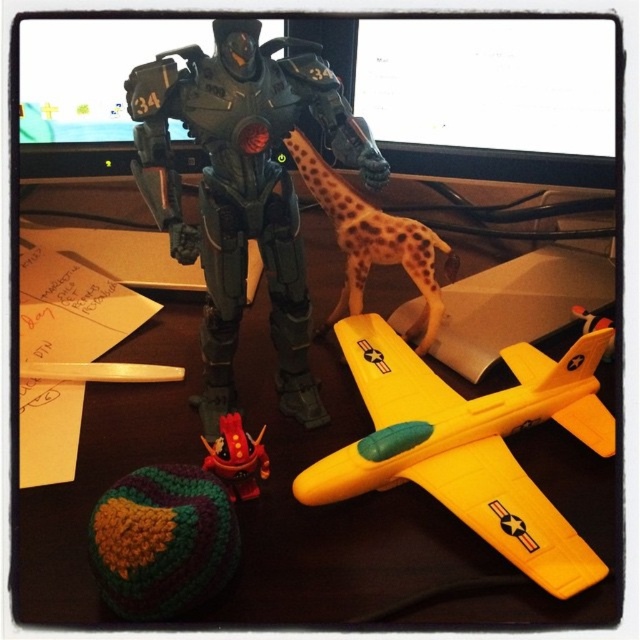
Question: Which object appears closest to the camera in this image?

Choices:
 (A) yellow matte airplane at center
 (B) rubberized red robot at lower center

Answer: (A)

Question: Can you confirm if yellow matte airplane at center is bigger than spotted brown spotted toy at center?

Choices:
 (A) no
 (B) yes

Answer: (B)

Question: Does yellow matte airplane at center appear under rubberized red robot at lower center?

Choices:
 (A) no
 (B) yes

Answer: (A)

Question: Which point is farther to the camera?

Choices:
 (A) yellow matte airplane at center
 (B) multicolored knitted ball at lower left
 (C) metallic gray robot at center
 (D) rubberized red robot at lower center

Answer: (D)

Question: Can you confirm if multicolored knitted ball at lower left is positioned above black plastic table at center?

Choices:
 (A) no
 (B) yes

Answer: (A)

Question: Among these objects, which one is nearest to the camera?

Choices:
 (A) spotted brown spotted toy at center
 (B) black plastic table at center
 (C) rubberized red robot at lower center
 (D) multicolored knitted ball at lower left

Answer: (D)